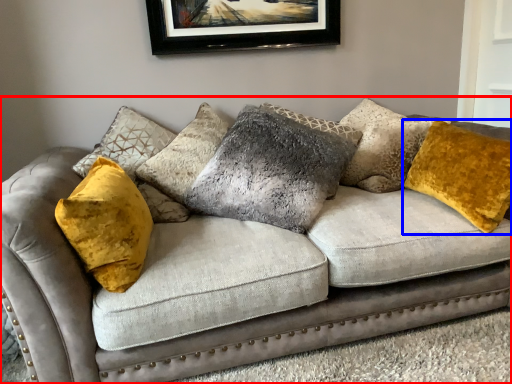
Question: Which object is further to the camera taking this photo, studio couch (highlighted by a red box) or pillow (highlighted by a blue box)?

Choices:
 (A) studio couch
 (B) pillow

Answer: (B)